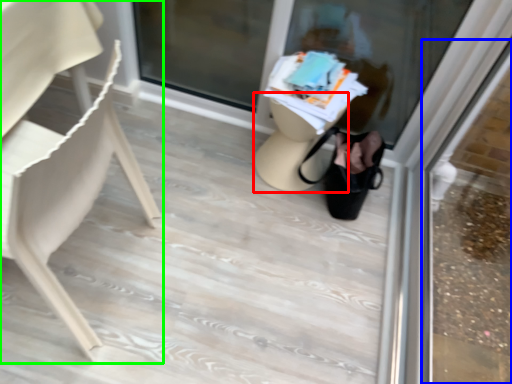
Question: Which object is positioned closest to table (highlighted by a red box)? Select from shop window (highlighted by a blue box) and chair (highlighted by a green box).

Choices:
 (A) shop window
 (B) chair

Answer: (B)